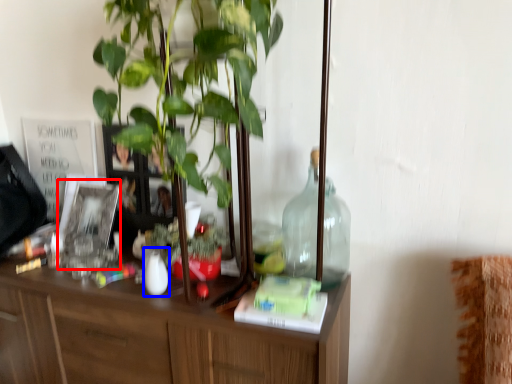
Question: Which object appears closest to the camera in this image, picture frame (highlighted by a red box) or vase (highlighted by a blue box)?

Choices:
 (A) picture frame
 (B) vase

Answer: (B)